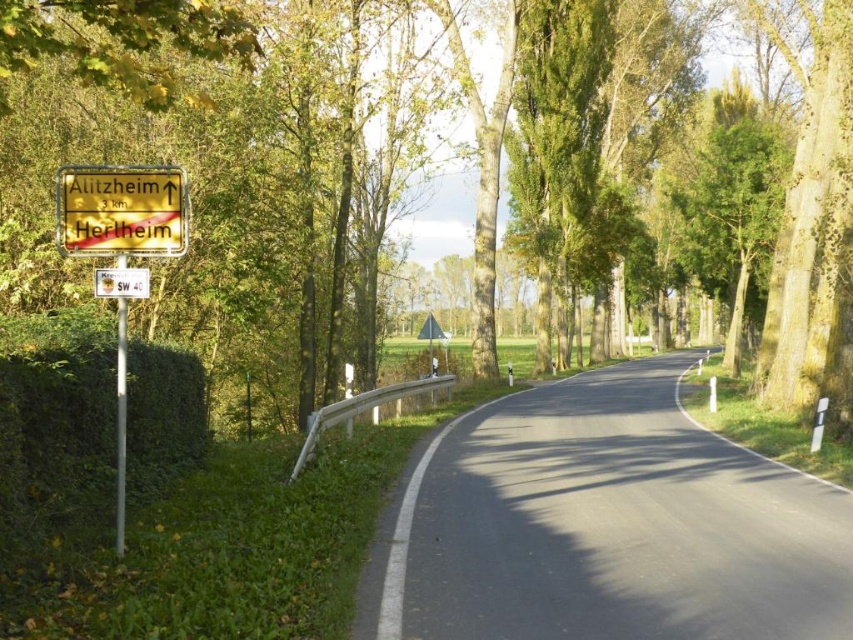
Which of these two, green leafy tree at left or yellow plastic sign at upper left, stands taller?

With more height is green leafy tree at left.

This screenshot has width=853, height=640. Describe the element at coordinates (430, 164) in the screenshot. I see `green leafy tree at left` at that location.

Image resolution: width=853 pixels, height=640 pixels. I want to click on green leafy tree at left, so click(x=430, y=164).

Who is lower down, yellow metallic sign at left or yellow plastic sign at upper left?

yellow plastic sign at upper left is lower down.

Can you confirm if yellow metallic sign at left is shorter than yellow plastic sign at upper left?

In fact, yellow metallic sign at left may be taller than yellow plastic sign at upper left.

Is point (102, 218) positioned behind point (131, 278)?

No, it is in front of (131, 278).

Locate an element on the screen. This screenshot has height=640, width=853. yellow metallic sign at left is located at coordinates (120, 211).

Between point (117, 378) and point (149, 237), which one is positioned in front?

Point (149, 237) is in front.

Between yellow metallic sign at left and yellow wooden sign at left, which one is positioned lower?

yellow metallic sign at left is lower down.

Is point (167, 252) closer to viewer compared to point (155, 186)?

No, it is behind (155, 186).

You are a GUI agent. You are given a task and a screenshot of the screen. Output one action in this format:
    pyautogui.click(x=<x>, y=<y>)
    Task: Click on the yellow metallic sign at left
    
    Given the screenshot: What is the action you would take?
    pyautogui.click(x=120, y=211)